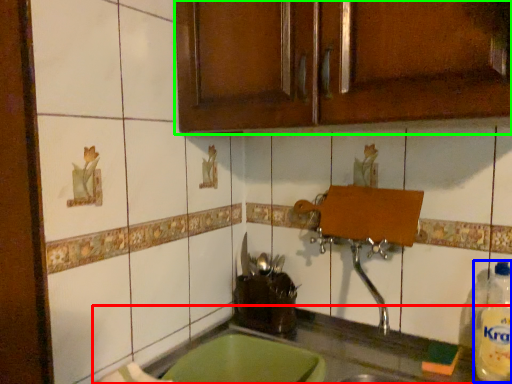
Question: Considering the real-world distances, which object is closest to countertop (highlighted by a red box)? bottle (highlighted by a blue box) or cabinetry (highlighted by a green box).

Choices:
 (A) bottle
 (B) cabinetry

Answer: (A)